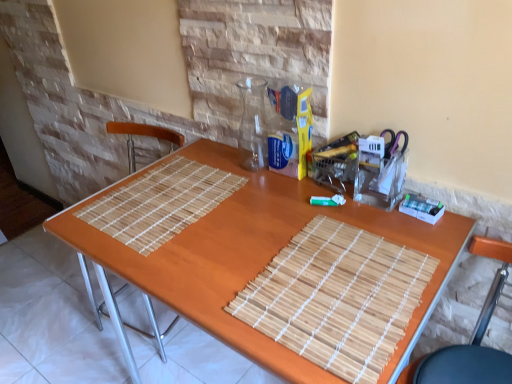
Question: In terms of width, does wooden chair at lower right look wider or thinner when compared to wooden table at center?

Choices:
 (A) thin
 (B) wide

Answer: (A)

Question: Considering the positions of wooden chair at lower right and wooden table at center in the image, is wooden chair at lower right bigger or smaller than wooden table at center?

Choices:
 (A) small
 (B) big

Answer: (A)

Question: Is wooden chair at lower right to the left or to the right of wooden table at center in the image?

Choices:
 (A) right
 (B) left

Answer: (A)

Question: Would you say wooden table at center is inside or outside wooden chair at lower right?

Choices:
 (A) outside
 (B) inside

Answer: (A)

Question: Is point (165, 254) positioned closer to the camera than point (480, 352)?

Choices:
 (A) closer
 (B) farther

Answer: (A)

Question: In the image, is wooden table at center positioned in front of or behind wooden chair at lower right?

Choices:
 (A) behind
 (B) front

Answer: (A)

Question: Looking at the image, does wooden table at center seem bigger or smaller compared to wooden chair at lower right?

Choices:
 (A) big
 (B) small

Answer: (A)